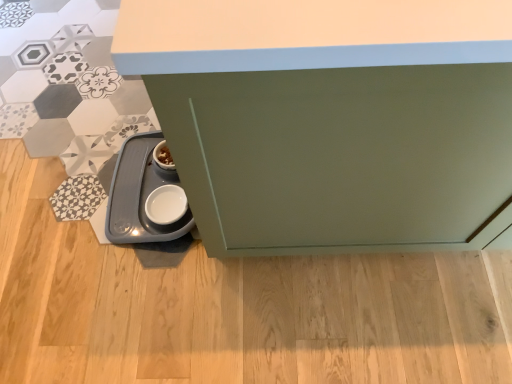
Question: From a real-world perspective, relative to white glossy pet feeder at lower left, is satin green cabinet at lower left vertically above or below?

Choices:
 (A) above
 (B) below

Answer: (A)

Question: Is point (267, 178) positioned closer to the camera than point (170, 175)?

Choices:
 (A) closer
 (B) farther

Answer: (A)

Question: From their relative heights in the image, would you say satin green cabinet at lower left is taller or shorter than white glossy pet feeder at lower left?

Choices:
 (A) tall
 (B) short

Answer: (A)

Question: Based on their sizes in the image, would you say white glossy pet feeder at lower left is bigger or smaller than satin green cabinet at lower left?

Choices:
 (A) big
 (B) small

Answer: (B)

Question: Considering the positions of white glossy pet feeder at lower left and satin green cabinet at lower left in the image, is white glossy pet feeder at lower left wider or thinner than satin green cabinet at lower left?

Choices:
 (A) thin
 (B) wide

Answer: (A)

Question: Is white glossy pet feeder at lower left in front of or behind satin green cabinet at lower left in the image?

Choices:
 (A) behind
 (B) front

Answer: (A)

Question: Is point (109, 228) positioned closer to the camera than point (293, 44)?

Choices:
 (A) farther
 (B) closer

Answer: (A)